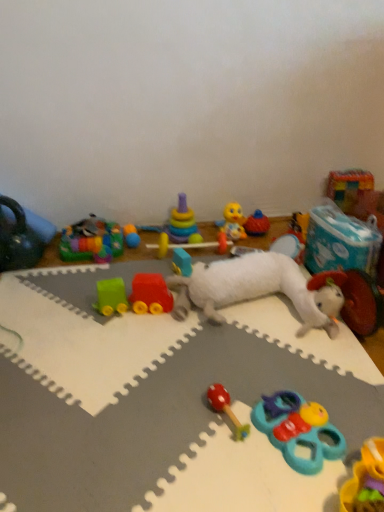
Find the location of a particular element. vacant location behind blue rubber toy at lower right, arranged as the eleventh toy when viewed from the left is located at coordinates (287, 372).